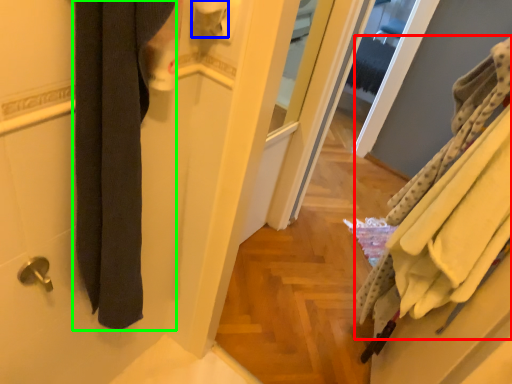
Question: Which object is positioned closest to bath towel (highlighted by a red box)? Select from toilet paper (highlighted by a blue box) and bath towel (highlighted by a green box).

Choices:
 (A) toilet paper
 (B) bath towel

Answer: (A)